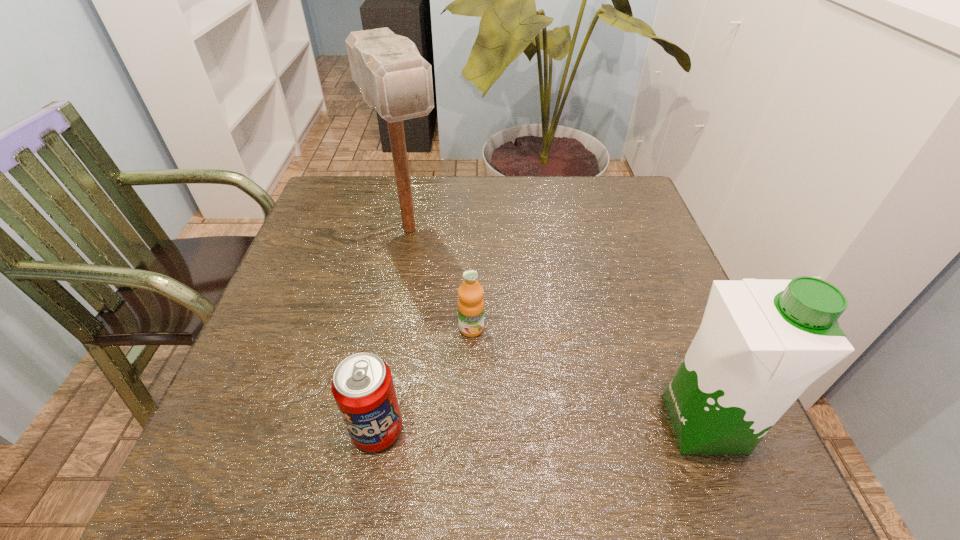
Locate an element on the screen. This screenshot has width=960, height=540. vacant space situated 0.130m above the head of the tallest object is located at coordinates (442, 291).

Image resolution: width=960 pixels, height=540 pixels. I want to click on vacant space located on the label of the orange juice, so click(481, 367).

Find the location of `vacant space located 0.200m on the label of the orange juice`. vacant space located 0.200m on the label of the orange juice is located at coordinates (496, 430).

The height and width of the screenshot is (540, 960). I want to click on vacant space located 0.110m on the label of the orange juice, so click(x=485, y=384).

Find the location of `object positioned at the far edge`. object positioned at the far edge is located at coordinates (394, 79).

The height and width of the screenshot is (540, 960). What are the coordinates of `soda can that is at the near edge` in the screenshot? It's located at (362, 385).

Where is `soya milk that is at the near edge`? This screenshot has width=960, height=540. soya milk that is at the near edge is located at coordinates (761, 343).

The width and height of the screenshot is (960, 540). What are the coordinates of `object present at the right edge` in the screenshot? It's located at (761, 343).

This screenshot has height=540, width=960. In order to click on object present at the near right corner in this screenshot , I will do (761, 343).

This screenshot has height=540, width=960. In order to click on vacant area at the far edge in this screenshot , I will do `click(417, 195)`.